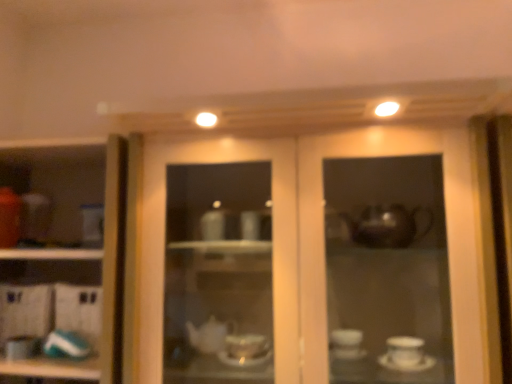
Question: Relative to teal glossy plate at lower left, which appears as the first tableware when viewed from the right, is matte glass cabinet at center in front or behind?

Choices:
 (A) front
 (B) behind

Answer: (A)

Question: In terms of height, does matte glass cabinet at center look taller or shorter compared to teal glossy plate at lower left, which appears as the first tableware when viewed from the right?

Choices:
 (A) tall
 (B) short

Answer: (A)

Question: Which object is positioned farthest from the matte glass cabinet at center?

Choices:
 (A) teal glossy plate at lower left, which appears as the first tableware when viewed from the right
 (B) white glossy cup at left
 (C) matte white teapot at lower left, which ranks as the first tableware in left-to-right order

Answer: (C)

Question: Which is farther from the white glossy cup at left?

Choices:
 (A) teal glossy plate at lower left, which appears as the first tableware when viewed from the right
 (B) matte white teapot at lower left, which ranks as the first tableware in left-to-right order
 (C) matte glass cabinet at center

Answer: (C)